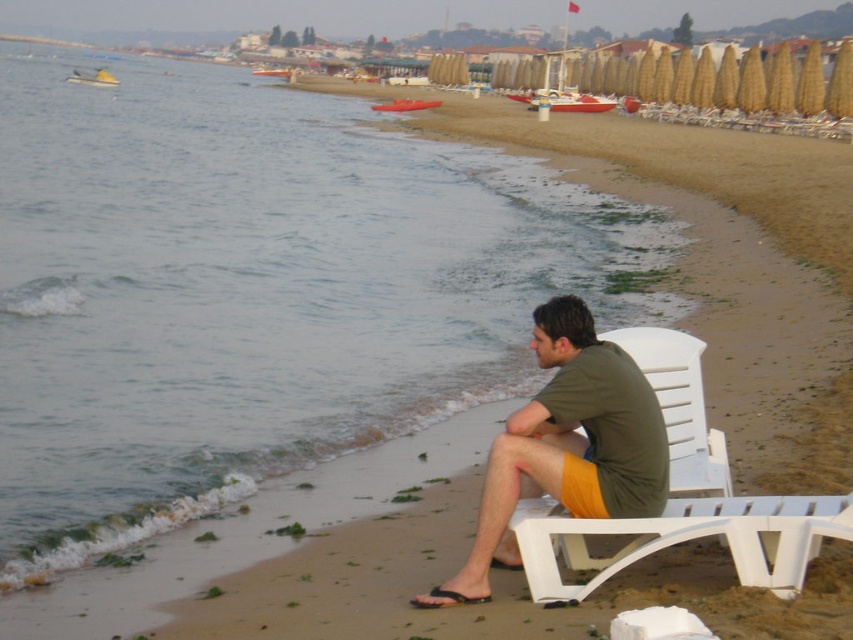
You are standing at the edge of the beach facing the sea. There are two points marked on the sand in front of you. One is at coordinates point [672,525] and the other at point [433,604]. Which point is closer to you?

The point at [672,525] is closer to you than the point at [433,604].

You are a photographer trying to capture the man in the green matte shirt at center and the black rubber sandal at lower center. To ensure both are in frame, should you adjust your camera to focus more to the left or the right?

The green matte shirt at center is to the right of the black rubber sandal at lower center, so you should focus more to the right to include both in the frame.